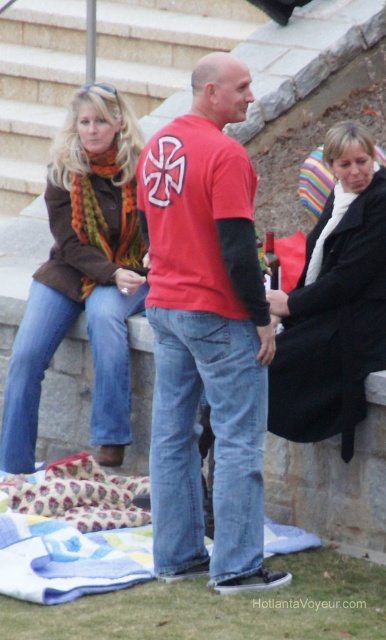
Does matte red t-shirt at center have a lesser width compared to multicolored scarf at upper left?

Indeed, matte red t-shirt at center has a lesser width compared to multicolored scarf at upper left.

Which is behind, point (250, 81) or point (69, 184)?

Positioned behind is point (69, 184).

I want to click on matte red t-shirt at center, so click(x=206, y=333).

The image size is (386, 640). I want to click on matte red t-shirt at center, so click(x=206, y=333).

Who is positioned more to the left, matte red t-shirt at center or patterned fabric blanket at lower center?

Positioned to the left is patterned fabric blanket at lower center.

Which of these two, matte red t-shirt at center or patterned fabric blanket at lower center, stands shorter?

patterned fabric blanket at lower center

The image size is (386, 640). Find the location of `matte red t-shirt at center`. matte red t-shirt at center is located at coordinates (206, 333).

Does matte red t-shirt at center appear on the right side of multicolored knitted scarf at left?

Indeed, matte red t-shirt at center is positioned on the right side of multicolored knitted scarf at left.

Between matte red t-shirt at center and multicolored knitted scarf at left, which one appears on the left side from the viewer's perspective?

multicolored knitted scarf at left is more to the left.

Measure the distance between point [181,208] and camera.

22.11 feet

The image size is (386, 640). I want to click on matte red t-shirt at center, so click(206, 333).